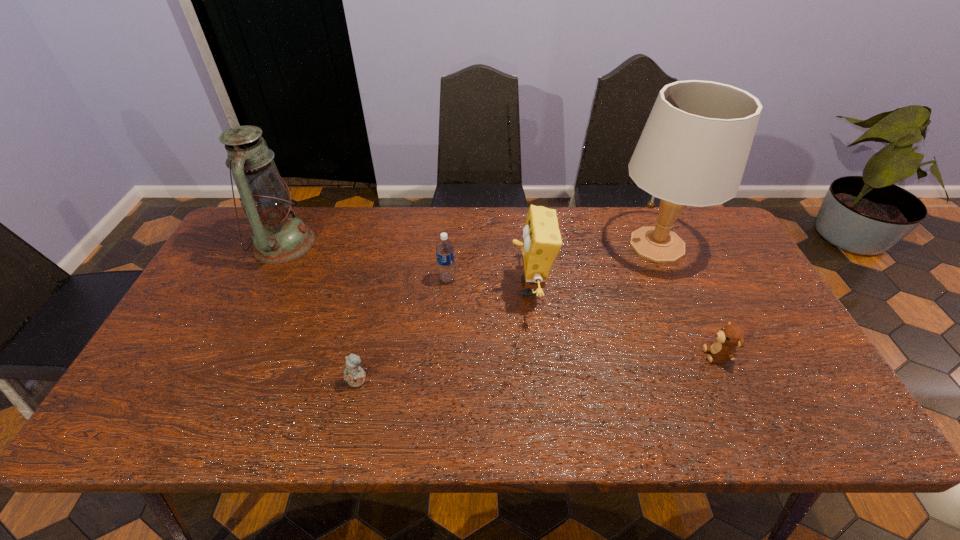
Where is `table lamp that is at the far edge`? Image resolution: width=960 pixels, height=540 pixels. table lamp that is at the far edge is located at coordinates (693, 150).

At what (x,y) coordinates should I click in order to perform the action: click on oil lamp positioned at the far edge. Please return your answer as a coordinate pair (x, y). Looking at the image, I should click on point(278,237).

Identify the location of sponge that is at the far edge. (541, 244).

Where is `object at the left edge`? object at the left edge is located at coordinates (278, 237).

Locate an element on the screen. The image size is (960, 540). object at the right edge is located at coordinates (693, 150).

This screenshot has width=960, height=540. What are the coordinates of `object located in the far left corner section of the desktop` in the screenshot? It's located at (278, 237).

The image size is (960, 540). What are the coordinates of `object located in the far right corner section of the desktop` in the screenshot? It's located at (693, 150).

In the image, there is a desktop. Identify the location of blank space at the far edge. Image resolution: width=960 pixels, height=540 pixels. (583, 210).

At what (x,y) coordinates should I click in order to perform the action: click on free space at the near edge. Please return your answer as a coordinate pair (x, y). This screenshot has height=540, width=960. Looking at the image, I should click on (732, 414).

The height and width of the screenshot is (540, 960). I want to click on blank area at the left edge, so click(209, 310).